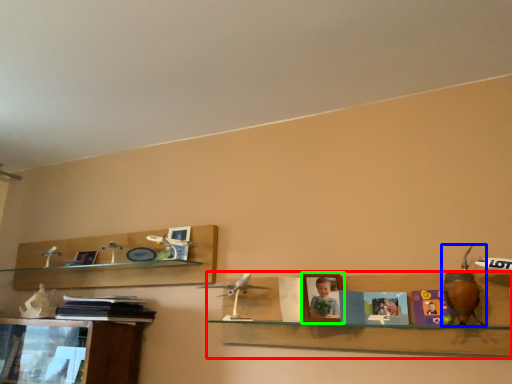
Question: Which is nearer to the shelf (highlighted by a red box)? toy (highlighted by a blue box) or picture frame (highlighted by a green box).

Choices:
 (A) toy
 (B) picture frame

Answer: (B)